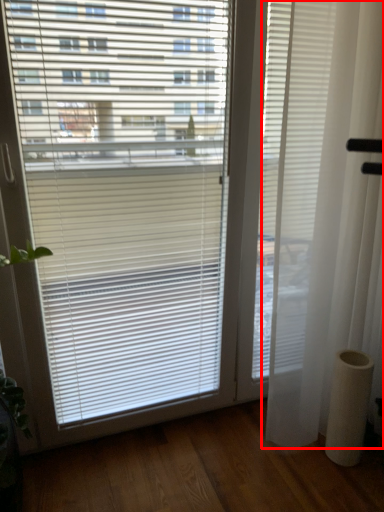
Question: From the image, what is the correct spatial relationship of curtain (annotated by the red box) in relation to pillar?

Choices:
 (A) right
 (B) left

Answer: (B)